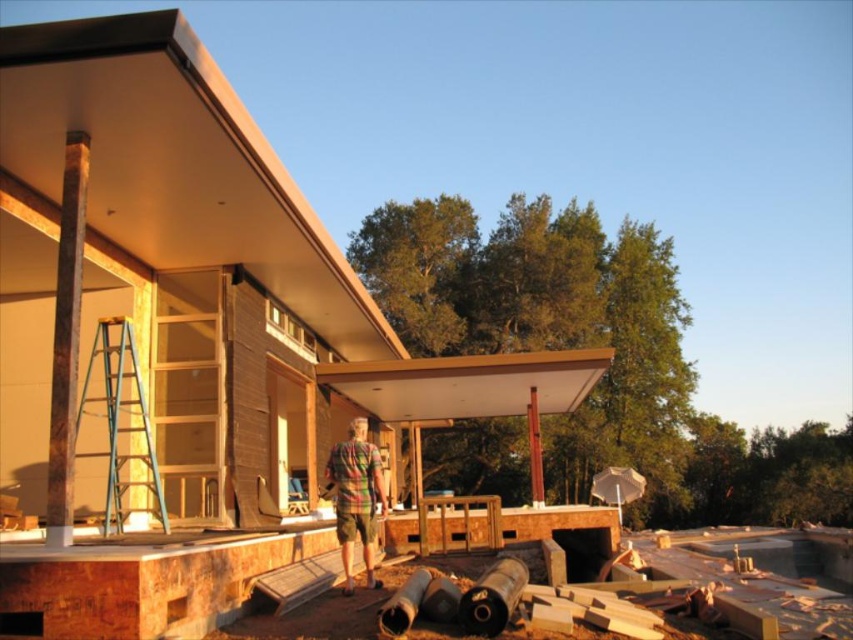
How far apart are metallic blue ladder at left and plaid fabric shirt at center?

2.66 meters

Is metallic blue ladder at left below plaid fabric shirt at center?

No.

Is point (107, 394) positioned after point (378, 500)?

No, (107, 394) is closer to viewer.

This screenshot has width=853, height=640. In order to click on metallic blue ladder at left in this screenshot , I will do `click(120, 420)`.